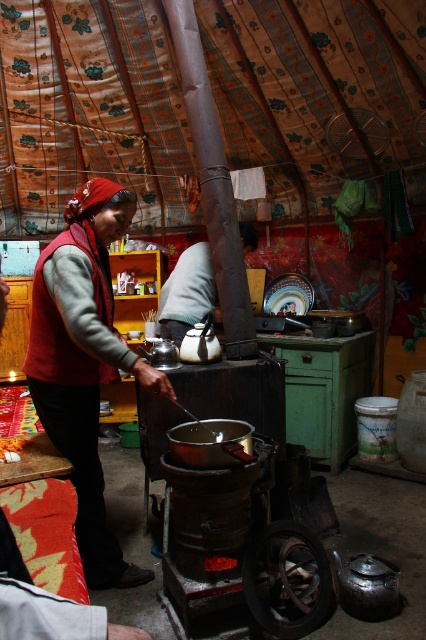
You are a fashion designer observing the woman in the scene. She is wearing a red woolen vest at center and a matte black shirt at center. Which piece of clothing is longer in height?

The red woolen vest at center is taller than the matte black shirt at center, so the red woolen vest at center is longer in height.